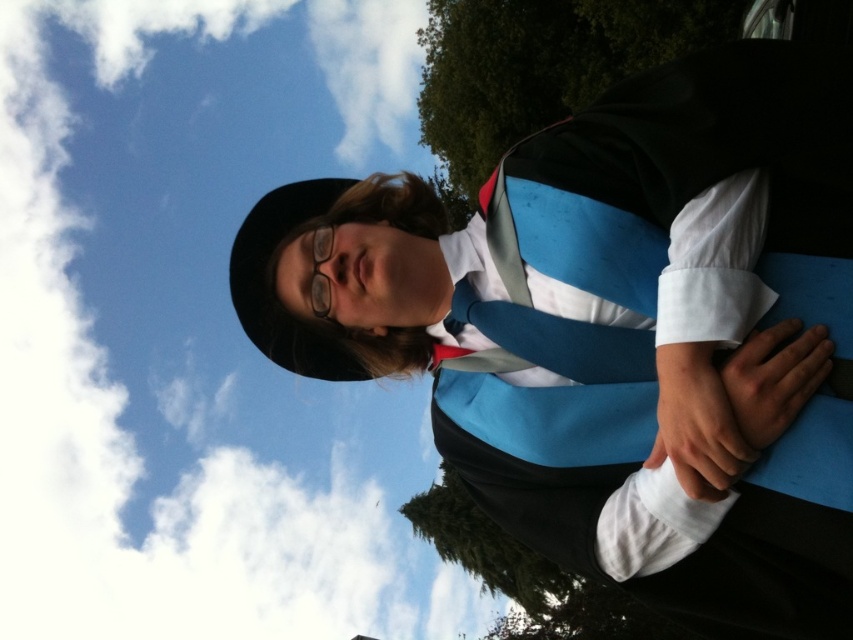
Question: Which point is farther to the camera?

Choices:
 (A) (332, 230)
 (B) (537, 12)
 (C) (440, 180)

Answer: (C)

Question: Is green leafy tree at center bigger than green leafy tree at upper center?

Choices:
 (A) no
 (B) yes

Answer: (B)

Question: Can you confirm if green leafy tree at center is bigger than transparent plastic glasses at center?

Choices:
 (A) no
 (B) yes

Answer: (B)

Question: Which object is the closest to the green leafy tree at upper center?

Choices:
 (A) transparent plastic glasses at center
 (B) green leafy tree at center

Answer: (B)

Question: Estimate the real-world distances between objects in this image. Which object is closer to the green leafy tree at center?

Choices:
 (A) green leafy tree at upper center
 (B) transparent plastic glasses at center

Answer: (A)

Question: Is green leafy tree at upper center smaller than transparent plastic glasses at center?

Choices:
 (A) no
 (B) yes

Answer: (A)